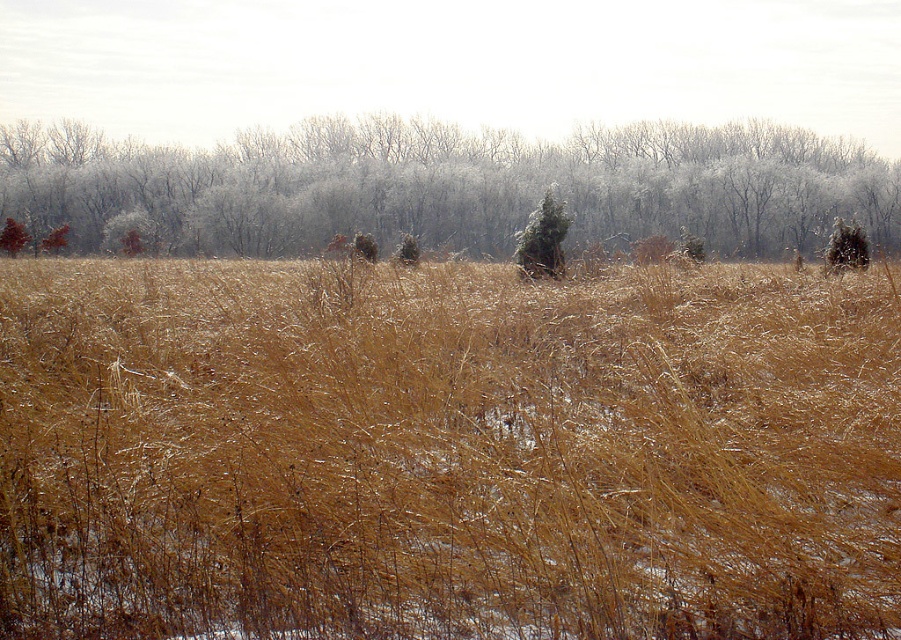
Question: Does frosted white tree at center appear on the left side of green textured pine at center?

Choices:
 (A) yes
 (B) no

Answer: (A)

Question: Which point is closer to the camera?

Choices:
 (A) (34, 140)
 (B) (551, 275)
 (C) (105, 308)

Answer: (C)

Question: Considering the relative positions of brown dry grass at center and frosted white tree at center in the image provided, where is brown dry grass at center located with respect to frosted white tree at center?

Choices:
 (A) right
 (B) left

Answer: (A)

Question: Which point appears farthest from the camera in this image?

Choices:
 (A) (561, 232)
 (B) (347, 371)

Answer: (A)

Question: Among these objects, which one is farthest from the camera?

Choices:
 (A) brown dry grass at center
 (B) frosted white tree at center

Answer: (B)

Question: Can you confirm if brown dry grass at center is positioned above green textured pine at center?

Choices:
 (A) no
 (B) yes

Answer: (A)